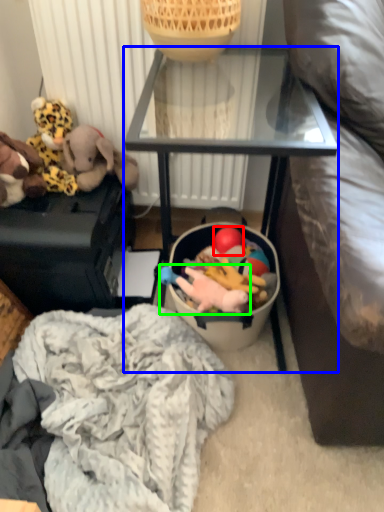
Question: Which object is positioned farthest from toy (highlighted by a red box)? Select from furniture (highlighted by a blue box) and toy (highlighted by a green box).

Choices:
 (A) furniture
 (B) toy

Answer: (A)